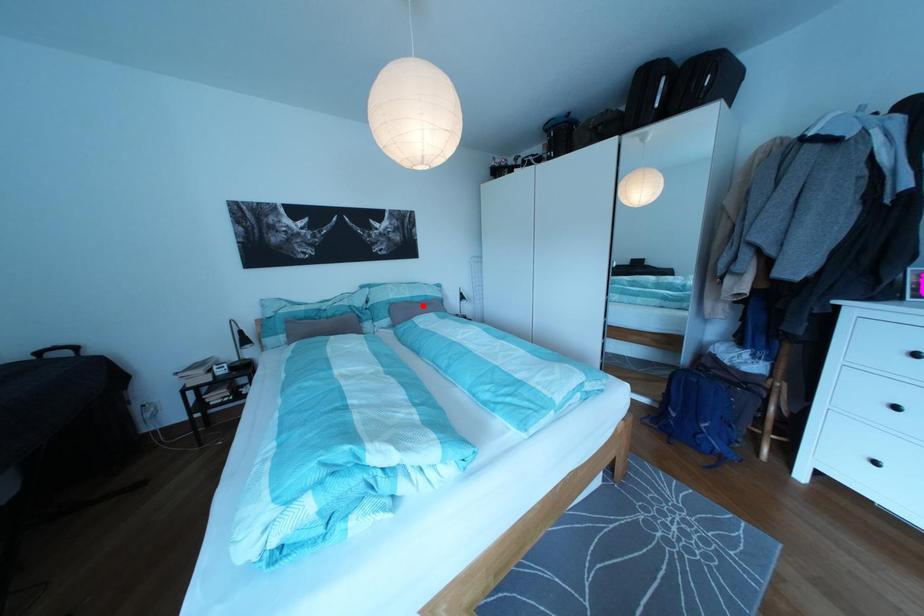
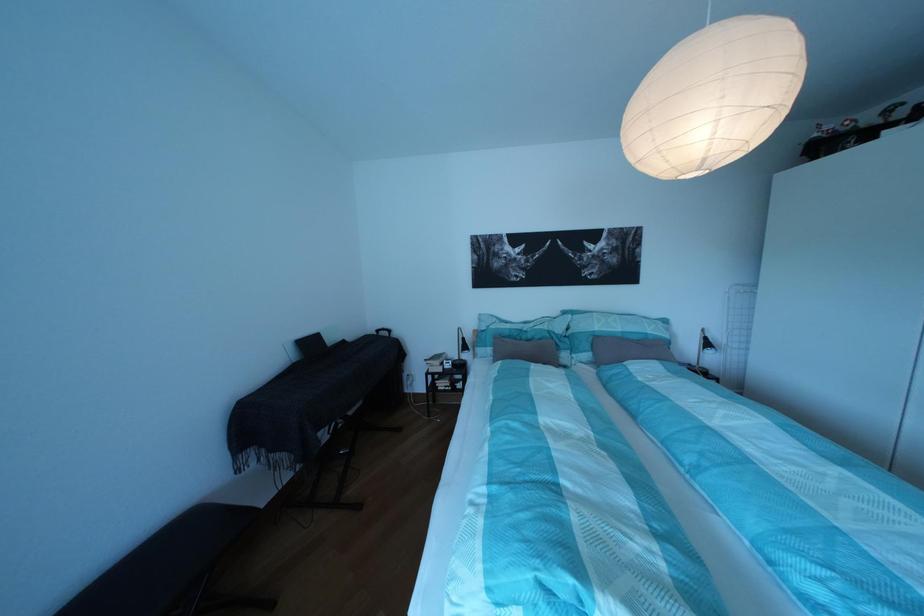
Question: I am providing you with two images of the same scene from different viewpoints. In image1, a red point is highlighted. Considering the same 3D point in image2, which of the following is correct?

Choices:
 (A) It is closer
 (B) It is farther

Answer: (B)